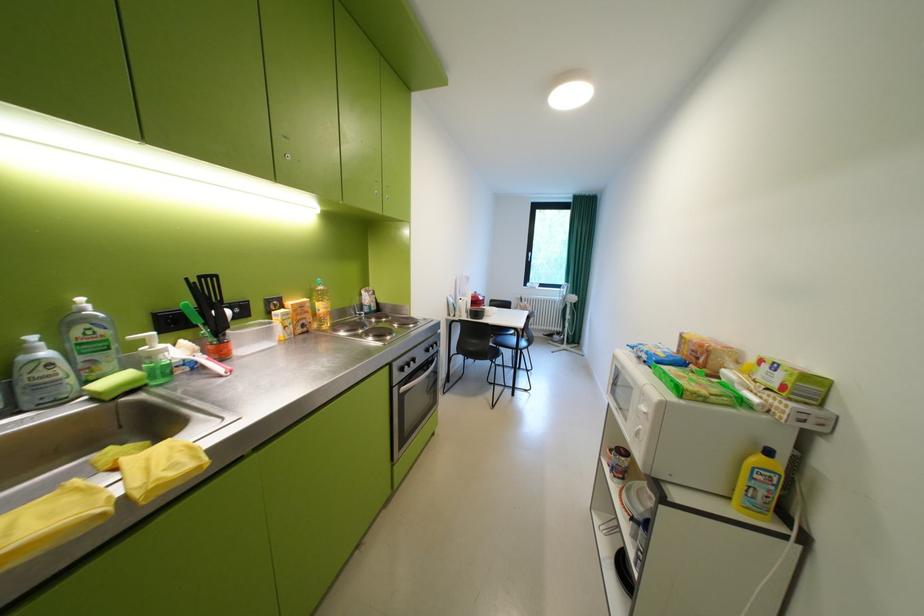
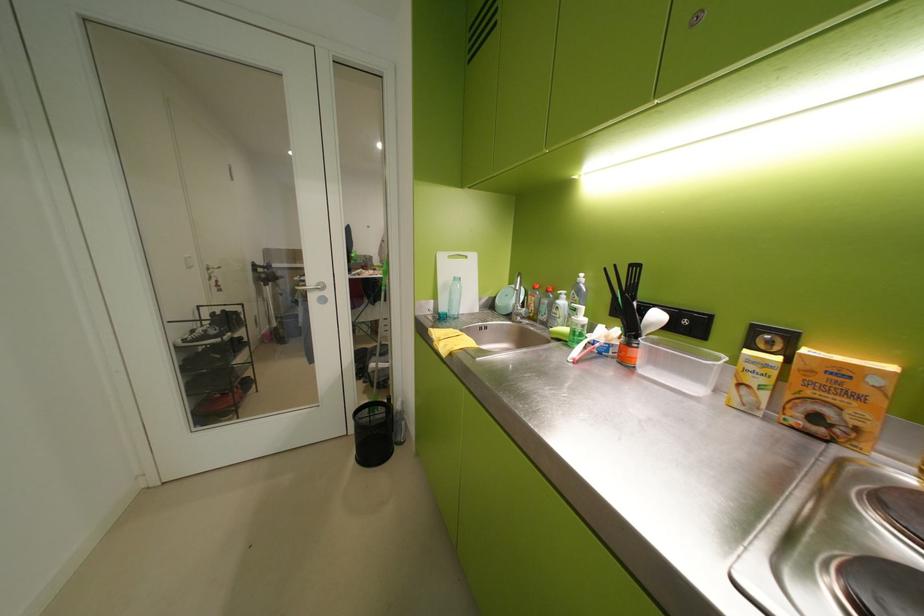
The point at (277, 302) is marked in the first image. Where is the corresponding point in the second image?

(767, 331)